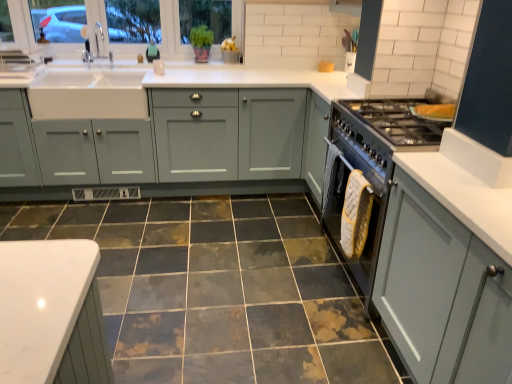
The image size is (512, 384). Identify the location of vacant area that lies to the right of teal matte soap dispenser at upper center. (170, 66).